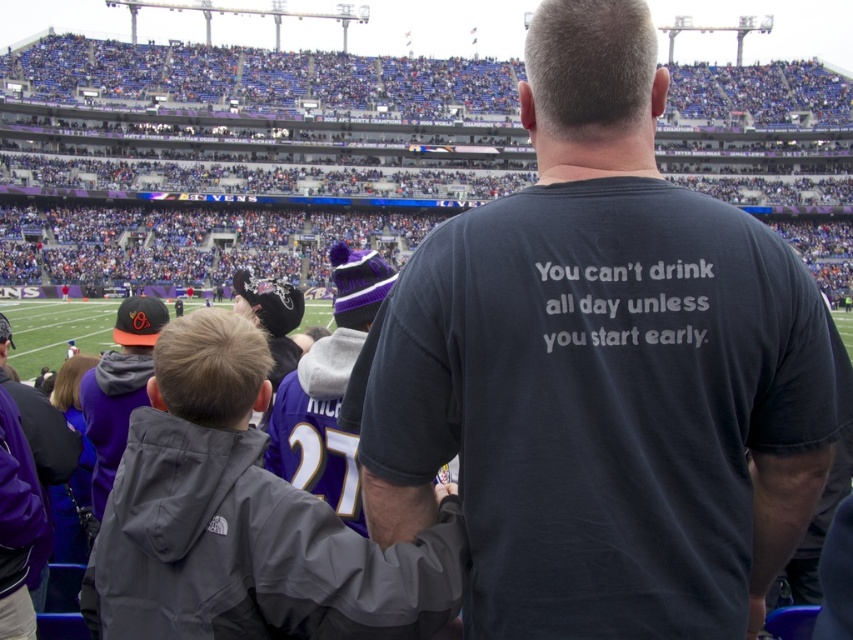
Who is positioned more to the left, purple knit hat at center or orange matte baseball cap at left?

Positioned to the left is orange matte baseball cap at left.

Does purple knit hat at center have a lesser width compared to orange matte baseball cap at left?

No.

Which is behind, point (337, 404) or point (144, 372)?

The point (144, 372) is behind.

Identify the location of purple knit hat at center. (328, 392).

Can you confirm if gray fabric jacket at center is shorter than purple knit hat at center?

Yes.

Is point (252, 589) closer to viewer compared to point (308, 461)?

Yes.

What do you see at coordinates (245, 520) in the screenshot?
I see `gray fabric jacket at center` at bounding box center [245, 520].

Where is `gray fabric jacket at center`? This screenshot has width=853, height=640. gray fabric jacket at center is located at coordinates (245, 520).

Is dark gray t-shirt at center in front of purple knit hat at center?

Yes, dark gray t-shirt at center is closer to the viewer.

The height and width of the screenshot is (640, 853). Identify the location of dark gray t-shirt at center. (601, 372).

Between point (776, 332) and point (347, 292), which one is positioned behind?

Point (347, 292)

Locate an element on the screen. This screenshot has width=853, height=640. dark gray t-shirt at center is located at coordinates 601,372.